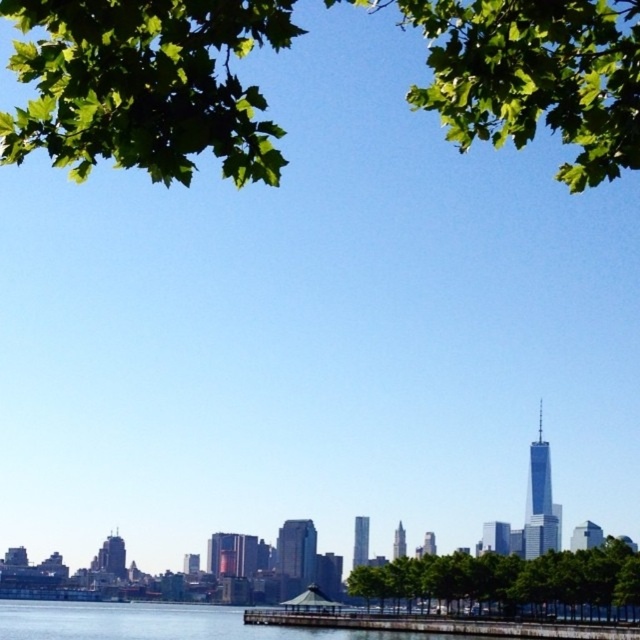
Is green leafy tree at upper center further to camera compared to green leafy tree at center?

Yes, it is behind green leafy tree at center.

Which is behind, point (152, 68) or point (593, 582)?

The point (152, 68) is more distant.

Where is `green leafy tree at upper center`? green leafy tree at upper center is located at coordinates (145, 84).